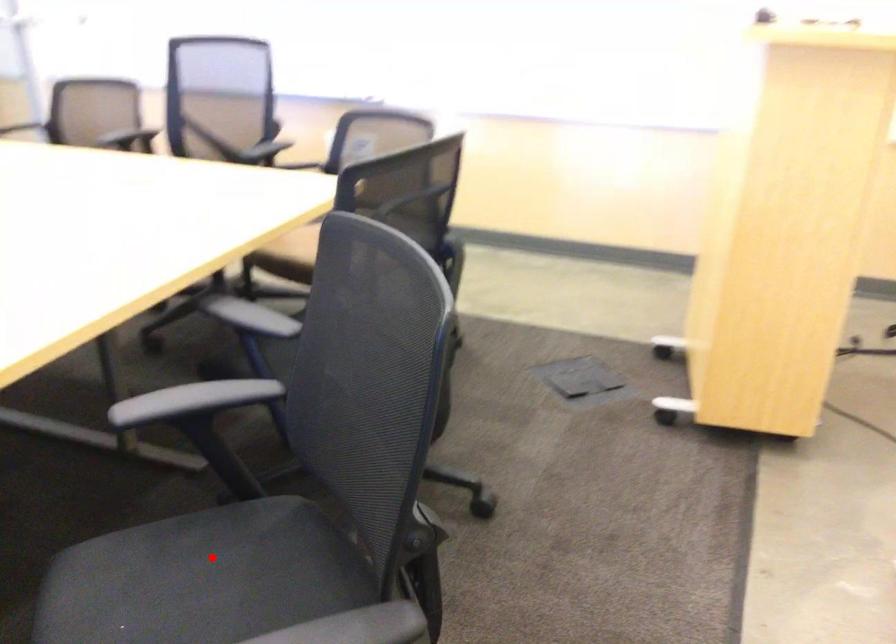
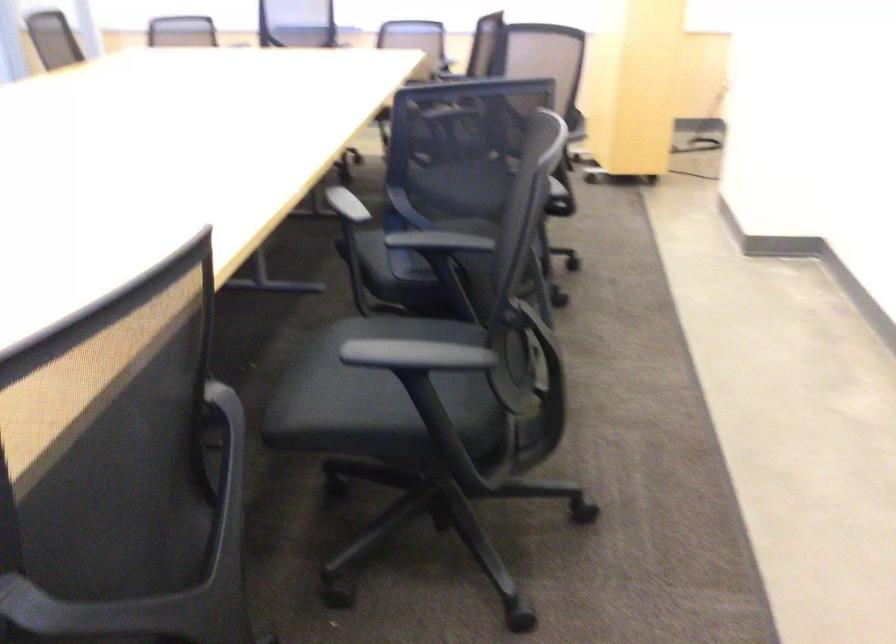
Question: I am providing you with two images of the same scene from different viewpoints. A red point is marked on the first image. At the location where the point appears in image 1, is it still visible in image 2?

Choices:
 (A) Yes
 (B) No

Answer: (B)